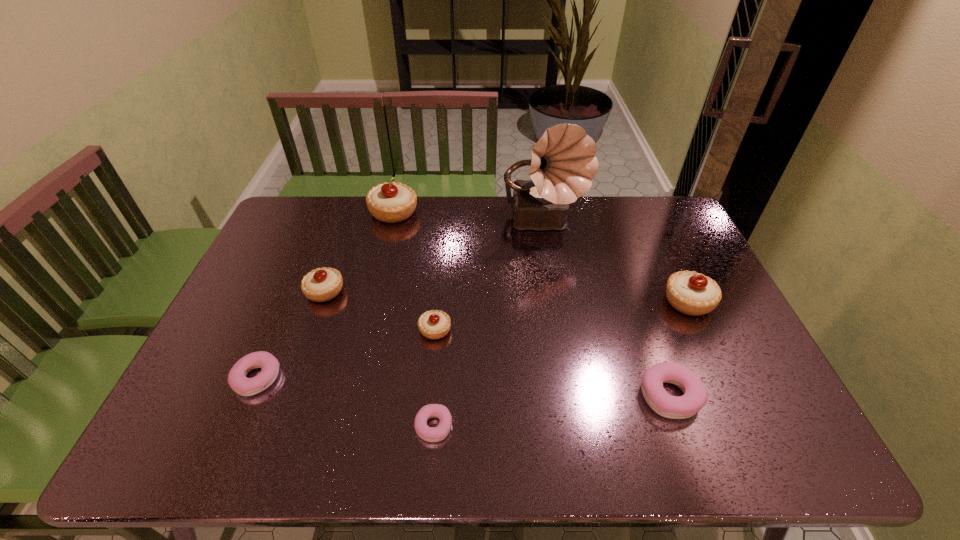
This screenshot has height=540, width=960. Identify the location of vacant space at the near edge. (653, 437).

Identify the location of vacant space at the left edge. (226, 402).

At what (x,y) coordinates should I click in order to perform the action: click on blank space at the right edge. Please return your answer as a coordinate pair (x, y). Image resolution: width=960 pixels, height=540 pixels. Looking at the image, I should click on (711, 381).

Where is `vacant space at the far left corner of the desktop`? vacant space at the far left corner of the desktop is located at coordinates (x=308, y=206).

Identify the location of vacant space at the far right corner of the desktop. This screenshot has height=540, width=960. (663, 226).

At what (x,y) coordinates should I click in order to perform the action: click on free space between the fourth tallest pastry and the second tallest object. Please return your answer as a coordinate pair (x, y). Looking at the image, I should click on (415, 271).

At what (x,y) coordinates should I click in order to perform the action: click on blank region between the leftmost beige pastry and the sixth shortest pastry. Please return your answer as a coordinate pair (x, y). The width and height of the screenshot is (960, 540). Looking at the image, I should click on (507, 296).

The image size is (960, 540). Find the location of `vacant region between the third biggest beige pastry and the seventh object from left to right`. vacant region between the third biggest beige pastry and the seventh object from left to right is located at coordinates (497, 343).

Locate an element on the screen. This screenshot has height=540, width=960. vacant area that lies between the third beige pastry from left to right and the second tallest object is located at coordinates (415, 271).

Find the location of a particular element. This screenshot has width=960, height=540. free spot between the leftmost pink pastry and the smallest pink pastry is located at coordinates (346, 402).